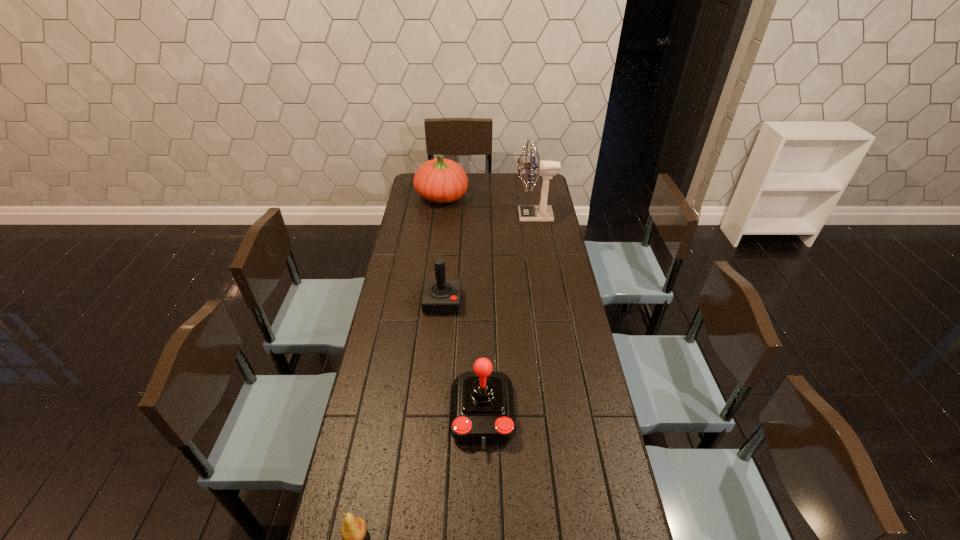
Image resolution: width=960 pixels, height=540 pixels. I want to click on vacant space situated 0.350m on the base of the farther joystick, so click(x=434, y=398).

This screenshot has height=540, width=960. Find the location of `object located in the far edge section of the desktop`. object located in the far edge section of the desktop is located at coordinates (439, 180).

At what (x,y) coordinates should I click in order to perform the action: click on pumpkin that is at the left edge. Please return your answer as a coordinate pair (x, y). Looking at the image, I should click on (439, 180).

The image size is (960, 540). In order to click on joystick located at the left edge in this screenshot , I will do click(440, 296).

At what (x,y) coordinates should I click in order to perform the action: click on object present at the right edge. Please return your answer as a coordinate pair (x, y). This screenshot has height=540, width=960. Looking at the image, I should click on (547, 169).

Where is `object at the far left corner`? Image resolution: width=960 pixels, height=540 pixels. object at the far left corner is located at coordinates (439, 180).

The height and width of the screenshot is (540, 960). Identify the location of vacant space at the far edge of the desktop. (470, 178).

Where is `vacant space at the left edge of the desktop`? This screenshot has width=960, height=540. vacant space at the left edge of the desktop is located at coordinates (387, 365).

What are the coordinates of `vacant region at the right edge of the desktop` in the screenshot? It's located at [538, 253].

I want to click on vacant space in between the rightmost object and the pumpkin, so click(488, 206).